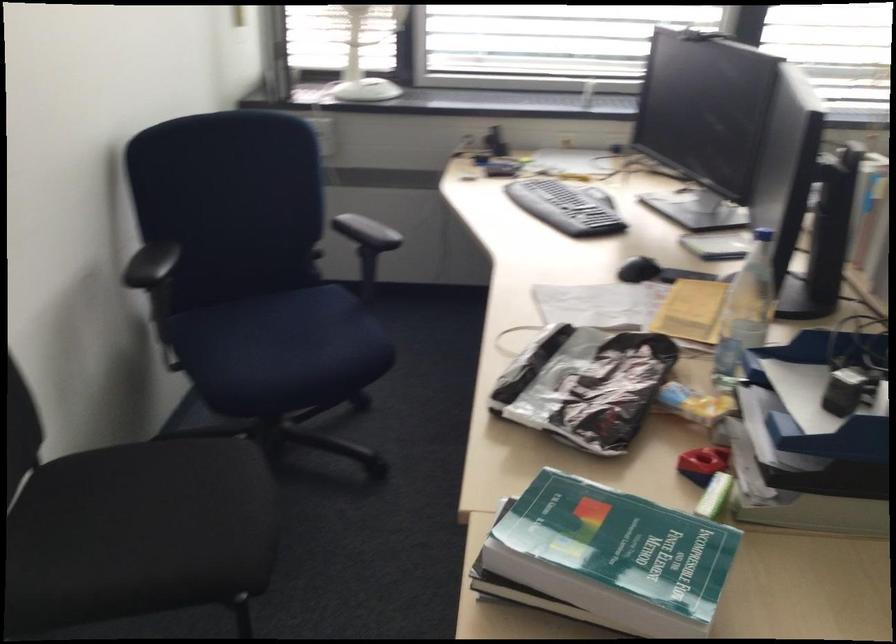
The height and width of the screenshot is (644, 896). In order to click on blue chair sitting surface in this screenshot , I will do (278, 346).